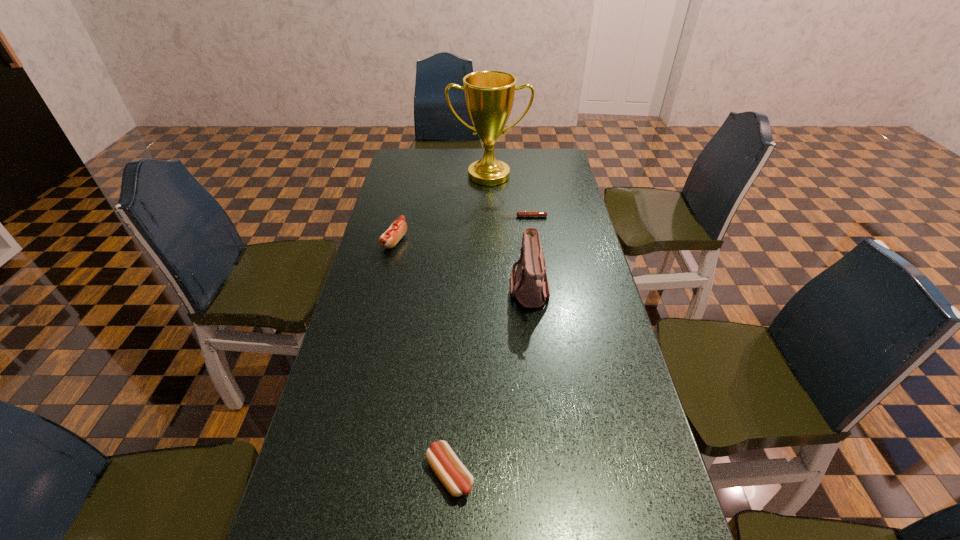
Identify the location of free space between the shoulder bag and the fourth tallest object. (490, 382).

This screenshot has width=960, height=540. Find the location of `free space that is in between the second farthest object and the leftmost sausage`. free space that is in between the second farthest object and the leftmost sausage is located at coordinates (459, 229).

Where is `vacant space that's between the rightmost sausage and the nearest sausage`? vacant space that's between the rightmost sausage and the nearest sausage is located at coordinates (487, 345).

At what (x,y) coordinates should I click in order to perform the action: click on the closest object to the second tallest object. Please return your answer as a coordinate pair (x, y). The height and width of the screenshot is (540, 960). Looking at the image, I should click on (521, 213).

Find the location of a particular element. The image size is (960, 540). object that is the closest to the third farthest object is located at coordinates (489, 95).

Locate which sausage ranks second in proximity to the tallest object. Please provide its 2D coordinates. Your answer should be formatted as a tuple, i.e. [(x, y)], where the tuple contains the x and y coordinates of a point satisfying the conditions above.

[(389, 239)]

Identify which sausage is located as the second nearest to the rightmost sausage. Please provide its 2D coordinates. Your answer should be formatted as a tuple, i.e. [(x, y)], where the tuple contains the x and y coordinates of a point satisfying the conditions above.

[(451, 472)]

This screenshot has width=960, height=540. I want to click on free point that satisfies the following two spatial constraints: 1. by the handles of the farthest sausage; 2. on the left side of the award, so click(490, 217).

Identify the location of blank area in the image that satisfies the following two spatial constraints: 1. on the back side of the leftmost sausage; 2. on the right side of the shortest object. The image size is (960, 540). (400, 217).